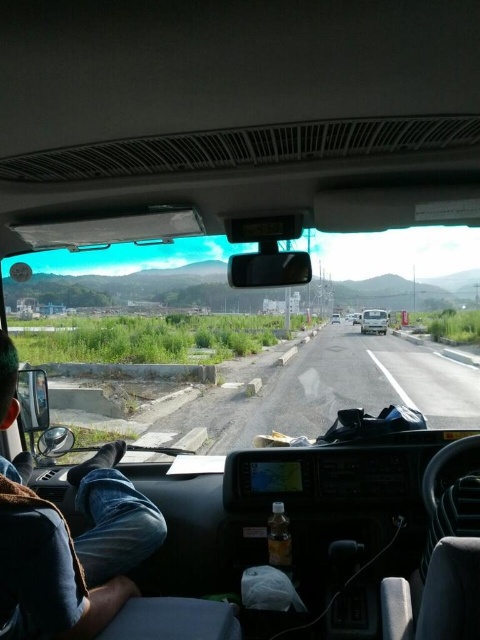
You are a passenger in the vehicle and need to step out onto the gravel road at center. To avoid stepping on the jeans at lower left, which direction should you move before exiting?

You should move to the right side before exiting to avoid stepping on the jeans at lower left since the jeans at lower left is positioned on the left side of gravel road at center.

Consider the image. You are a passenger in the van and need to reach the emergency exit lever located on the right side of the white matte van at center. Considering the jeans at lower left are blocking the path, can you still reach the lever?

The jeans at lower left are positioned on the left side of the white matte van at center, so they are blocking the path to the right side. Therefore, you might not be able to reach the emergency exit lever on the right side without moving the jeans at lower left.

Based on the photo, you are a passenger in the vehicle and need to reach the dashboard controls located at the center. Which direction should you move your jeans at lower left to access the controls?

You need to move your jeans at lower left to the right since they are currently positioned at point [72,552], which is to the far left of the dashboard controls at the center.